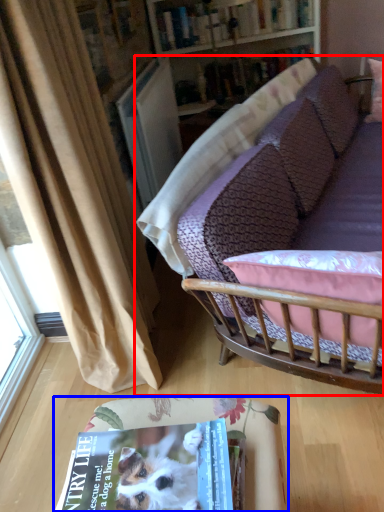
Question: Which object is closer to the camera taking this photo, studio couch (highlighted by a red box) or table (highlighted by a blue box)?

Choices:
 (A) studio couch
 (B) table

Answer: (B)